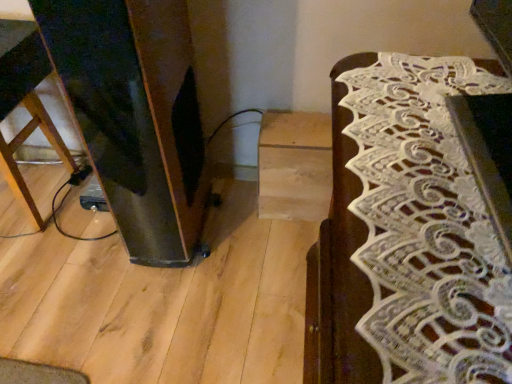
In order to click on vacant point above white lace table runner at right, which appears as the 1th furniture when viewed from the right (from a real-world perspective) in this screenshot , I will do `click(436, 142)`.